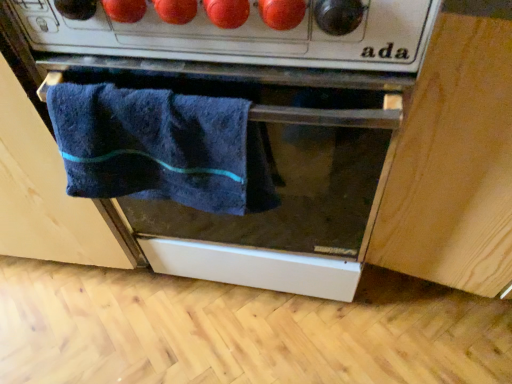
Question: From a real-world perspective, is navy blue towel at center physically below dark blue towel at center, which is the 2th cabinetry in right-to-left order?

Choices:
 (A) yes
 (B) no

Answer: (B)

Question: Is navy blue towel at center positioned before dark blue towel at center, marked as the first cabinetry in a left-to-right arrangement?

Choices:
 (A) no
 (B) yes

Answer: (B)

Question: Is navy blue towel at center in contact with dark blue towel at center, marked as the first cabinetry in a left-to-right arrangement?

Choices:
 (A) no
 (B) yes

Answer: (A)

Question: Is navy blue towel at center oriented towards dark blue towel at center, which is the 2th cabinetry in right-to-left order?

Choices:
 (A) no
 (B) yes

Answer: (A)

Question: Does navy blue towel at center have a greater width compared to dark blue towel at center, which is the 2th cabinetry in right-to-left order?

Choices:
 (A) yes
 (B) no

Answer: (B)

Question: From the image's perspective, is navy blue towel at center on top of dark blue towel at center, marked as the first cabinetry in a left-to-right arrangement?

Choices:
 (A) yes
 (B) no

Answer: (B)

Question: Does matte black oven at center appear on the right side of navy blue towel at center?

Choices:
 (A) yes
 (B) no

Answer: (A)

Question: Does matte black oven at center contain navy blue towel at center?

Choices:
 (A) yes
 (B) no

Answer: (A)

Question: Can you see matte black oven at center touching navy blue towel at center?

Choices:
 (A) no
 (B) yes

Answer: (A)

Question: Is matte black oven at center far away from navy blue towel at center?

Choices:
 (A) yes
 (B) no

Answer: (B)

Question: Does matte black oven at center lie behind navy blue towel at center?

Choices:
 (A) yes
 (B) no

Answer: (B)

Question: Is matte black oven at center facing towards navy blue towel at center?

Choices:
 (A) no
 (B) yes

Answer: (B)

Question: Is dark blue towel at center, marked as the first cabinetry in a left-to-right arrangement, completely or partially outside of matte black oven at center?

Choices:
 (A) no
 (B) yes

Answer: (B)